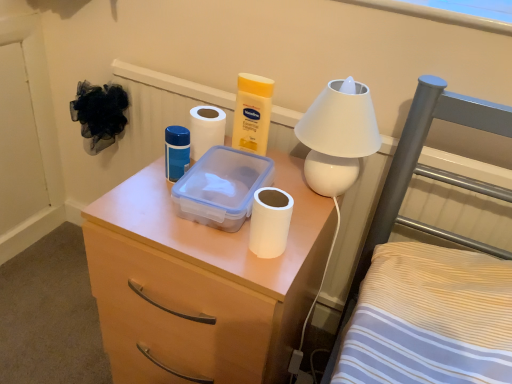
Question: Is white matte plastic at center spatially inside transparent plastic storage box at center, or outside of it?

Choices:
 (A) outside
 (B) inside

Answer: (A)

Question: Considering the positions of white matte plastic at center and transparent plastic storage box at center in the image, is white matte plastic at center wider or thinner than transparent plastic storage box at center?

Choices:
 (A) wide
 (B) thin

Answer: (A)

Question: Estimate the real-world distances between objects in this image. Which object is closer to the white matte toilet paper at center, the second toilet paper ordered from the bottom?

Choices:
 (A) blue matte container at center
 (B) white matte plastic at center
 (C) transparent plastic storage box at center
 (D) white glossy lamp at upper right
 (E) white matte toilet paper at center, which ranks as the 1th toilet paper in bottom-to-top order

Answer: (A)

Question: Estimate the real-world distances between objects in this image. Which object is closer to the blue matte container at center?

Choices:
 (A) white matte toilet paper at center, arranged as the 1th toilet paper when viewed from the back
 (B) transparent plastic storage box at center
 (C) white matte plastic at center
 (D) white glossy lamp at upper right
 (E) white matte toilet paper at center, which ranks as the 1th toilet paper in bottom-to-top order

Answer: (A)